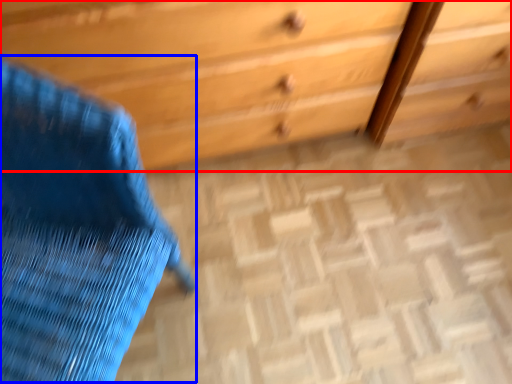
Question: Which object appears farthest to the camera in this image, chest of drawers (highlighted by a red box) or swivel chair (highlighted by a blue box)?

Choices:
 (A) chest of drawers
 (B) swivel chair

Answer: (A)